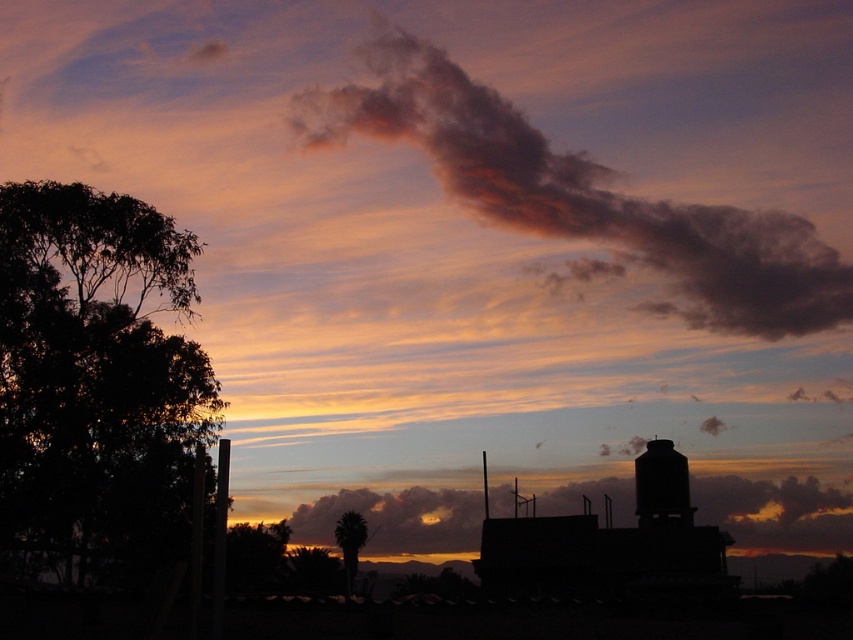
Can you confirm if dark green leafy tree at left is positioned to the right of green leafy tree at center?

In fact, dark green leafy tree at left is to the left of green leafy tree at center.

Does point (27, 205) come closer to viewer compared to point (339, 516)?

Yes, it is in front of point (339, 516).

Locate an element on the screen. The width and height of the screenshot is (853, 640). dark green leafy tree at left is located at coordinates (96, 381).

Does dark green leafy tree at left appear on the left side of smoky gray cloud at upper center?

Yes, dark green leafy tree at left is to the left of smoky gray cloud at upper center.

Does dark green leafy tree at left have a greater height compared to smoky gray cloud at upper center?

No, dark green leafy tree at left is not taller than smoky gray cloud at upper center.

Which is behind, point (30, 227) or point (511, 163)?

The point (511, 163) is more distant.

At what (x,y) coordinates should I click in order to perform the action: click on dark green leafy tree at left. Please return your answer as a coordinate pair (x, y). Looking at the image, I should click on (96, 381).

What do you see at coordinates (776, 513) in the screenshot? The image size is (853, 640). I see `cloudy sky at center` at bounding box center [776, 513].

Between point (743, 499) and point (363, 532), which one is positioned in front?

Point (363, 532) is more forward.

Where is `cloudy sky at center`? The width and height of the screenshot is (853, 640). cloudy sky at center is located at coordinates (776, 513).